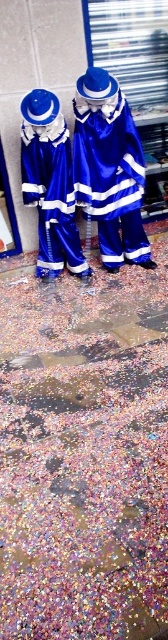
Question: Is confetti at lower center thinner than shiny blue costume at center?

Choices:
 (A) yes
 (B) no

Answer: (B)

Question: Is shiny blue costume at center positioned behind blue satin robe at center?

Choices:
 (A) no
 (B) yes

Answer: (A)

Question: Is the position of confetti at lower center less distant than that of shiny blue costume at center?

Choices:
 (A) no
 (B) yes

Answer: (B)

Question: Which of the following is the farthest from the observer?

Choices:
 (A) blue satin robe at center
 (B) shiny blue costume at center
 (C) confetti at lower center

Answer: (A)

Question: Which of the following is the farthest from the observer?

Choices:
 (A) (44, 474)
 (B) (50, 241)

Answer: (B)

Question: Which object appears closest to the camera in this image?

Choices:
 (A) blue satin robe at center
 (B) confetti at lower center
 (C) shiny blue costume at center

Answer: (B)